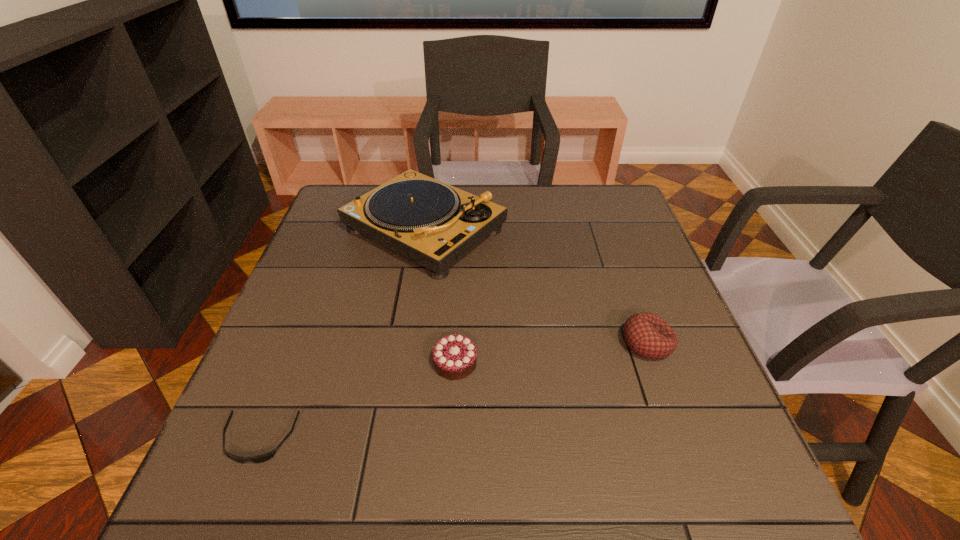
Where is `free spot between the nearest object and the tallest object`? The image size is (960, 540). free spot between the nearest object and the tallest object is located at coordinates 342,335.

The width and height of the screenshot is (960, 540). I want to click on empty space that is in between the sunglasses and the record player, so click(x=342, y=335).

You are a GUI agent. You are given a task and a screenshot of the screen. Output one action in this format:
    pyautogui.click(x=<x>, y=<y>)
    Task: Click on the free space that is in between the rightmost object and the shortest object
    
    Given the screenshot: What is the action you would take?
    pyautogui.click(x=453, y=392)

Find the location of a particular element. The height and width of the screenshot is (540, 960). vacant space that's between the second shortest object and the rightmost object is located at coordinates (551, 353).

Locate an element on the screen. This screenshot has height=540, width=960. the second closest object to the nearest object is located at coordinates (428, 221).

Find the location of a particular element. Image resolution: width=960 pixels, height=540 pixels. object that stands as the second closest to the sunglasses is located at coordinates (428, 221).

At what (x,y) coordinates should I click in order to perform the action: click on vacant point that satisfies the following two spatial constraints: 1. on the back side of the beanbag; 2. on the right side of the third tallest object. Please return your answer as a coordinate pair (x, y). This screenshot has height=540, width=960. Looking at the image, I should click on (456, 343).